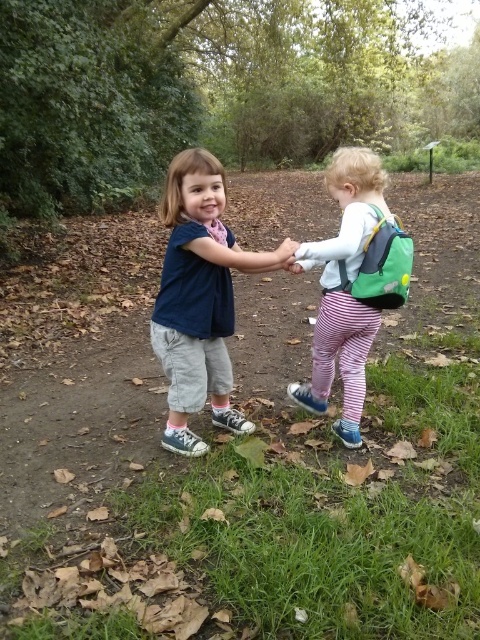
You are a photographer trying to capture the striped cotton pants at center in your shot. Based on the coordinates provided, where should you position your camera to ensure the pants are centered in the frame?

The striped cotton pants at center are already positioned at the coordinates point (x=344, y=289), so centering your camera on those coordinates will ensure the pants are centered in the frame.

You are a photographer setting up a shot of two children in a park. You need to ensure the matte blue shirt at center and striped cotton pants at center are both in frame. Which direction should you move the camera to get both items centered?

Move the camera to the right so that the matte blue shirt at center comes into the center of the frame, as it is currently to the left of the striped cotton pants at center.